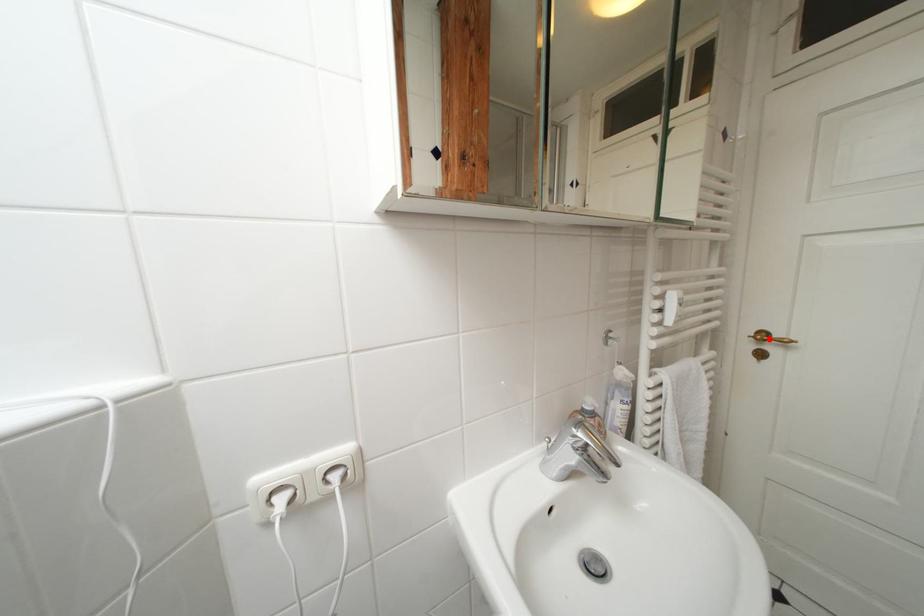
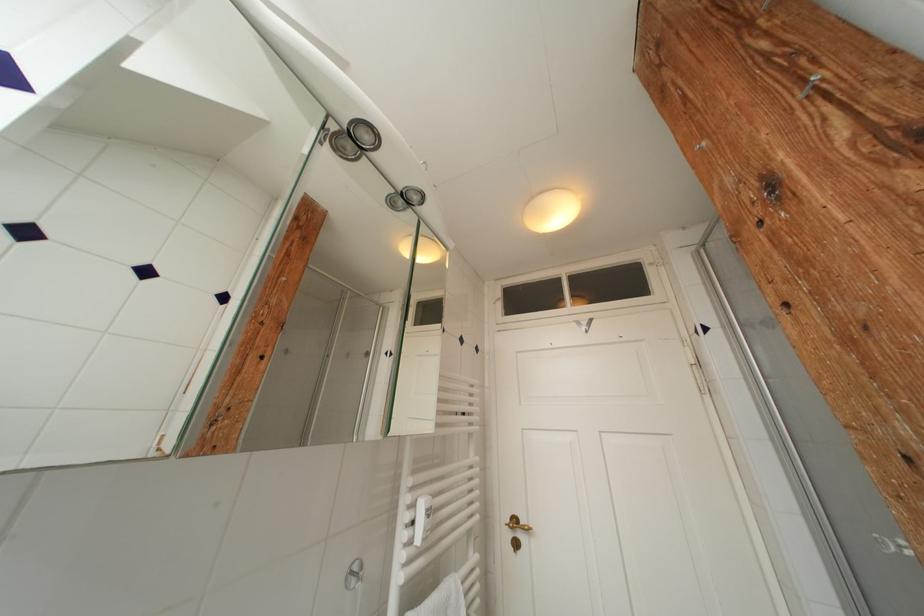
Find the pixel in the second image that matches the highlighted location in the first image.

(521, 525)